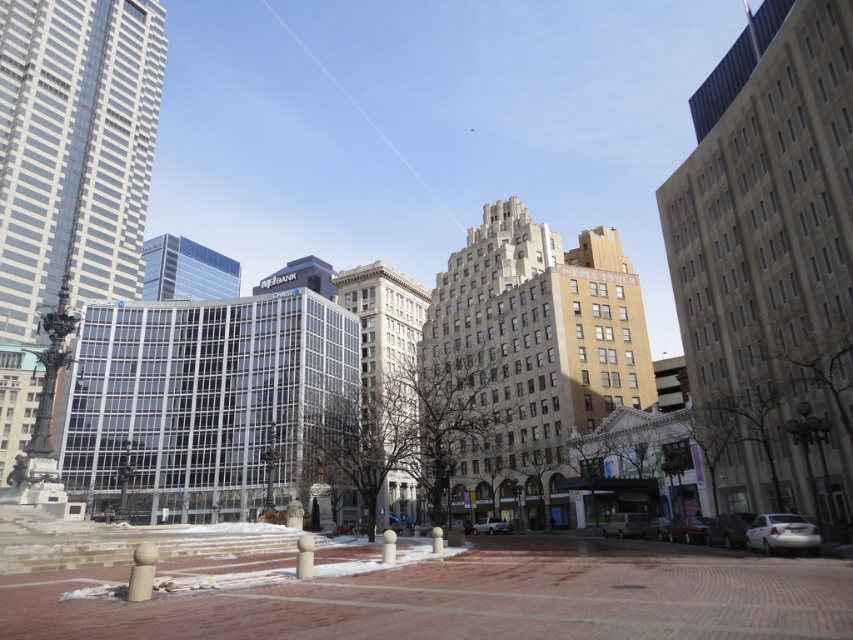
Between glassy reflective skyscraper at left and metallic silver van at lower right, which one is positioned lower?

metallic silver van at lower right is below.

Does glassy reflective skyscraper at left lie behind metallic silver van at lower right?

Yes, it is.

Which is in front, point (68, 49) or point (611, 513)?

Point (611, 513) is more forward.

The width and height of the screenshot is (853, 640). Identify the location of glassy reflective skyscraper at left. (74, 150).

Which is behind, point (229, 273) or point (701, 524)?

Point (229, 273)

Where is `clear glass skyscraper at center`? The height and width of the screenshot is (640, 853). clear glass skyscraper at center is located at coordinates (186, 269).

The height and width of the screenshot is (640, 853). Find the location of `clear glass skyscraper at center`. clear glass skyscraper at center is located at coordinates (186, 269).

At what (x,y) coordinates should I click in order to perform the action: click on beige concrete building at right. Please return your answer as a coordinate pair (x, y). This screenshot has height=640, width=853. Looking at the image, I should click on (770, 260).

Does beige concrete building at right lie behind glassy reflective skyscraper at left?

No, it is not.

Where is `beige concrete building at right`? Image resolution: width=853 pixels, height=640 pixels. beige concrete building at right is located at coordinates (770, 260).

This screenshot has height=640, width=853. I want to click on beige concrete building at right, so pyautogui.click(x=770, y=260).